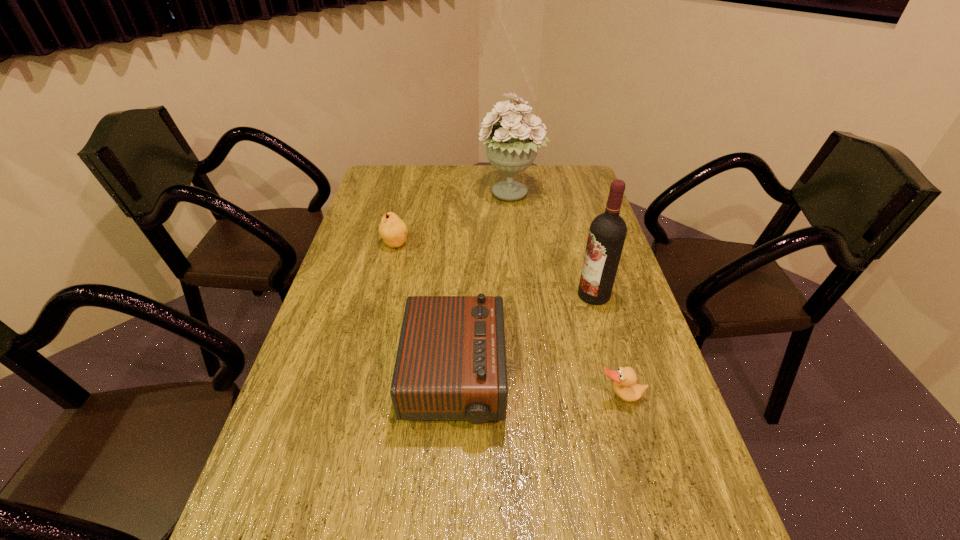
Find the location of `bouquet`. bouquet is located at coordinates (511, 147).

Find the location of `wine bottle`. wine bottle is located at coordinates (607, 233).

This screenshot has height=540, width=960. I want to click on the third shortest object, so click(x=451, y=364).

You are a GUI agent. You are given a task and a screenshot of the screen. Output one action in this format:
    pyautogui.click(x=<x>, y=<y>)
    Task: Click on the fourth nearest object
    The width and height of the screenshot is (960, 540).
    Given the screenshot: What is the action you would take?
    pyautogui.click(x=393, y=230)

I want to click on the leftmost object, so coord(393,230).

Identify the location of duck. (625, 386).

Find the location of a particular element. This screenshot has height=540, width=960. free space located 0.120m on the front of the bouquet is located at coordinates (514, 232).

Find the location of a particular element. This screenshot has height=540, width=960. vacant space situated 0.210m on the label of the wine bottle is located at coordinates (504, 295).

I want to click on vacant space situated on the label of the wine bottle, so click(468, 295).

Identify the location of free space located 0.290m on the label of the wine bottle. (475, 295).